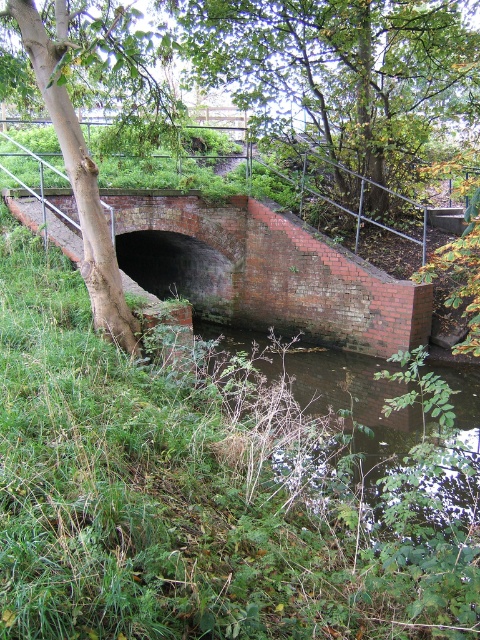
The image size is (480, 640). What do you see at coordinates (339, 72) in the screenshot? I see `green leafy tree at upper center` at bounding box center [339, 72].

Does point (355, 125) come closer to viewer compared to point (109, 275)?

No, (355, 125) is further to viewer.

The image size is (480, 640). I want to click on green leafy tree at upper center, so click(x=339, y=72).

Can you confirm if brick at center is thinner than green rough bark tree at left?

Yes.

Image resolution: width=480 pixels, height=640 pixels. What are the coordinates of `brick at center` in the screenshot? It's located at (265, 272).

Between green leafy tree at upper center and brick at center, which one is positioned higher?

Positioned higher is green leafy tree at upper center.

Who is taller, green leafy tree at upper center or brick at center?

With more height is green leafy tree at upper center.

Identify the location of green leafy tree at upper center. Image resolution: width=480 pixels, height=640 pixels. (339, 72).

At what (x,y) coordinates should I click in order to perform the action: click on green leafy tree at upper center. Please return your answer as a coordinate pair (x, y). Looking at the image, I should click on [339, 72].